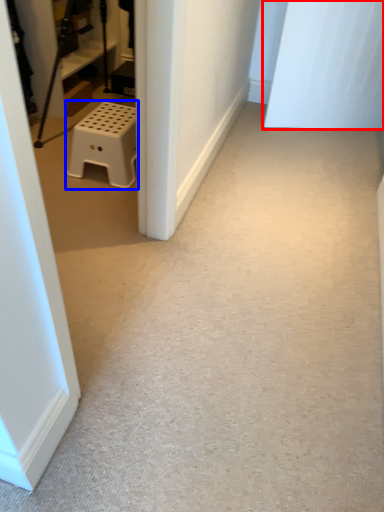
Question: Which point is closer to the camera, door (highlighted by a red box) or furniture (highlighted by a blue box)?

Choices:
 (A) door
 (B) furniture

Answer: (B)